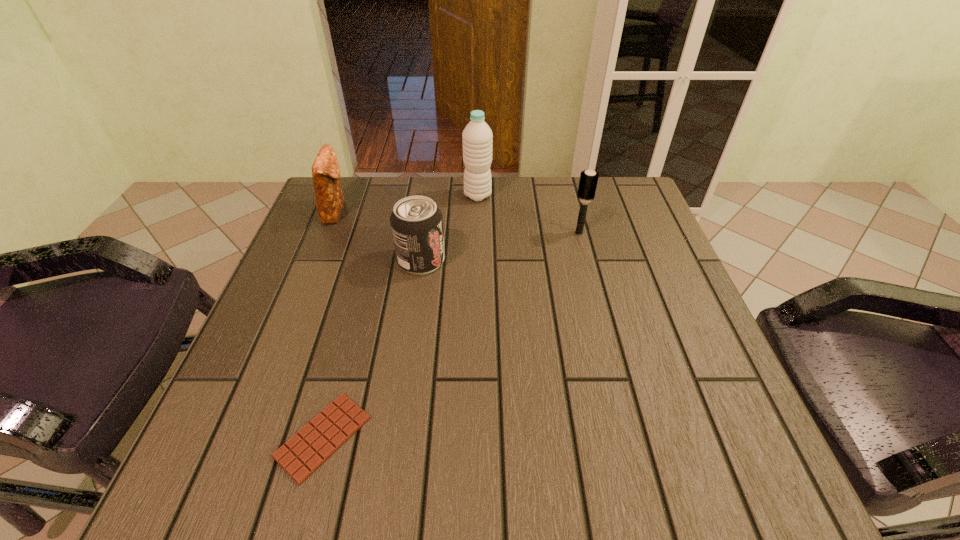
I want to click on object at the near left corner, so click(x=317, y=441).

Find the location of `vacant space at the far edge of the desktop`. vacant space at the far edge of the desktop is located at coordinates [475, 218].

Find the location of a particular element. This screenshot has width=960, height=540. free spot at the near edge of the desktop is located at coordinates click(429, 443).

Identify the location of free point at the left edge. Image resolution: width=960 pixels, height=540 pixels. (270, 301).

Identify the location of vacant space at the right edge. [x=660, y=383].

Image resolution: width=960 pixels, height=540 pixels. I want to click on vacant area at the far right corner, so click(x=636, y=215).

The height and width of the screenshot is (540, 960). In the image, there is a desktop. In order to click on vacant area at the near right corner in this screenshot , I will do `click(686, 491)`.

Locate an element on the screen. The height and width of the screenshot is (540, 960). free space between the nearest object and the rightmost object is located at coordinates (451, 335).

You are a GUI agent. You are given a task and a screenshot of the screen. Output one action in this format:
    pyautogui.click(x=<x>, y=<y>)
    Task: Click on the vacant region between the shortest object and the second nearest object
    
    Given the screenshot: What is the action you would take?
    pyautogui.click(x=372, y=349)

The width and height of the screenshot is (960, 540). I want to click on vacant point located between the water bottle and the second nearest object, so click(x=449, y=228).